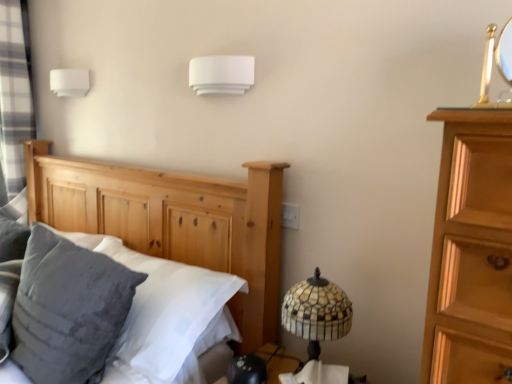
Question: Visually, is white plastic electric outlet at center positioned to the left or to the right of natural wood bed at left?

Choices:
 (A) left
 (B) right

Answer: (B)

Question: Looking at their shapes, would you say white plastic electric outlet at center is wider or thinner than natural wood bed at left?

Choices:
 (A) thin
 (B) wide

Answer: (A)

Question: Considering the real-world distances, which object is closest to the natural wood bed at left?

Choices:
 (A) velvety gray pillow at left
 (B) white plastic electric outlet at center
 (C) mosaic glass lampshade at lower right
 (D) white matte wall light at upper center, which ranks as the 1th lamp in right-to-left order
 (E) gray plaid curtain at left

Answer: (A)

Question: Which is farther from the mosaic glass lampshade at lower right?

Choices:
 (A) natural wood bed at left
 (B) white matte wall light at upper center, which appears as the second lamp when viewed from the back
 (C) white plastic electric outlet at center
 (D) gray plaid curtain at left
 (E) velvety gray pillow at left

Answer: (D)